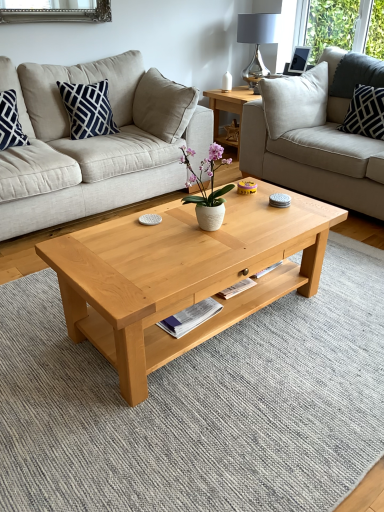
In order to click on free space in front of white ceramic vase at center in this screenshot , I will do `click(203, 253)`.